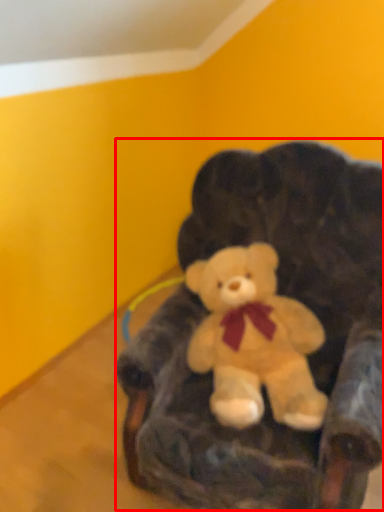
Question: Where is bean bag chair (annotated by the red box) located in relation to teddy bear in the image?

Choices:
 (A) right
 (B) left

Answer: (A)